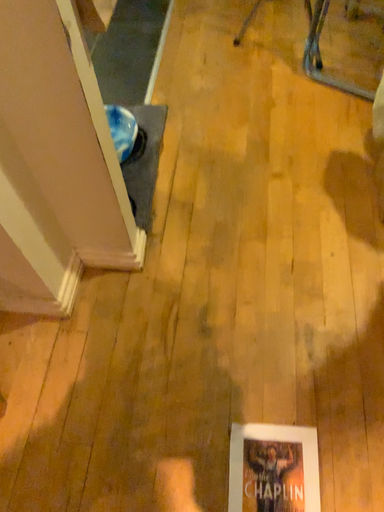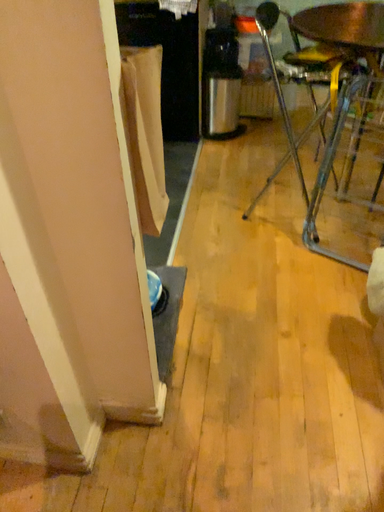
Question: How did the camera likely rotate when shooting the video?

Choices:
 (A) rotated downward
 (B) rotated upward

Answer: (B)